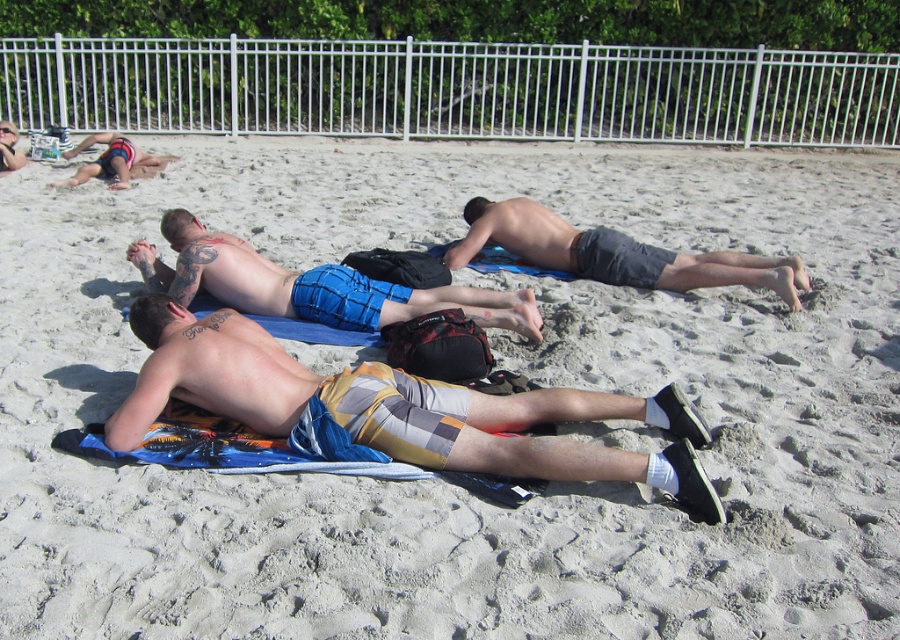
Between blue plaid shorts at center and dark gray shorts at center, which one has more height?

Standing taller between the two is dark gray shorts at center.

Does blue plaid shorts at center come behind dark gray shorts at center?

No, it is in front of dark gray shorts at center.

Measure the distance between point (370, 321) and camera.

5.27 meters

Locate an element on the screen. The width and height of the screenshot is (900, 640). blue plaid shorts at center is located at coordinates (310, 285).

Is plaid shorts at center to the right of blue plaid shorts at center from the viewer's perspective?

Correct, you'll find plaid shorts at center to the right of blue plaid shorts at center.

Is the position of plaid shorts at center less distant than that of blue plaid shorts at center?

Yes, it is.

Who is more distant from viewer, [394,401] or [297,296]?

The point [297,296] is more distant.

Identify the location of plaid shorts at center. Image resolution: width=900 pixels, height=640 pixels. (396, 408).

Is plaid shorts at center behind dark gray shorts at center?

No, plaid shorts at center is closer to the viewer.

Measure the distance between point [577,413] and camera.

Point [577,413] and camera are 4.06 meters apart from each other.

The height and width of the screenshot is (640, 900). Find the location of `plaid shorts at center`. plaid shorts at center is located at coordinates (396, 408).

Identify the location of plaid shorts at center. (396, 408).